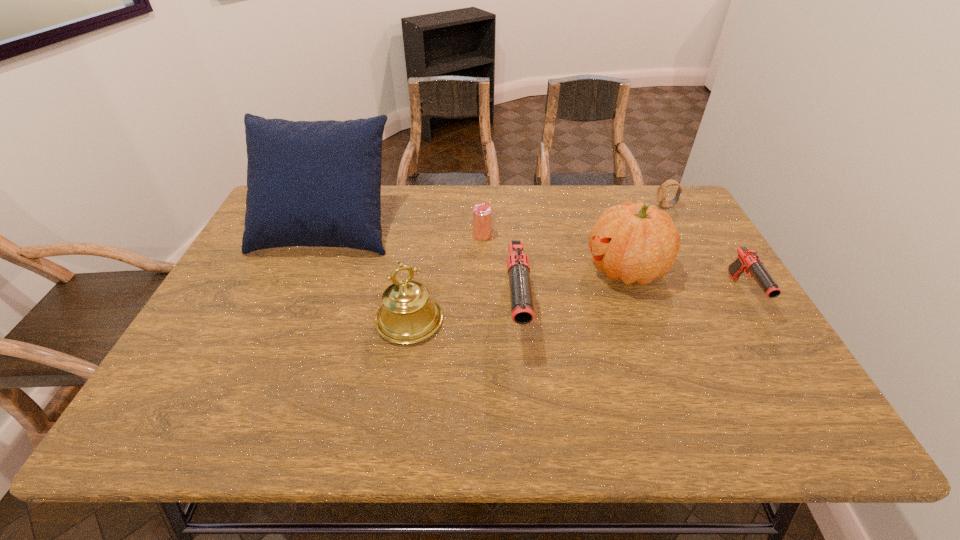
Please point a spot to add another gun on the left. Please provide its 2D coordinates. Your answer should be formatted as a tuple, i.e. [(x, y)], where the tuple contains the x and y coordinates of a point satisfying the conditions above.

[(267, 335)]